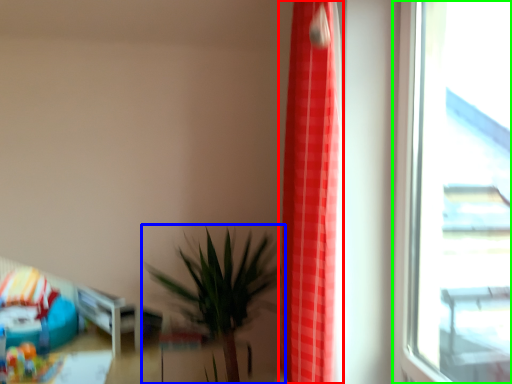
Question: Estimate the real-world distances between objects in this image. Which object is farther from curtain (highlighted by a red box), houseplant (highlighted by a blue box) or window (highlighted by a green box)?

Choices:
 (A) houseplant
 (B) window

Answer: (A)